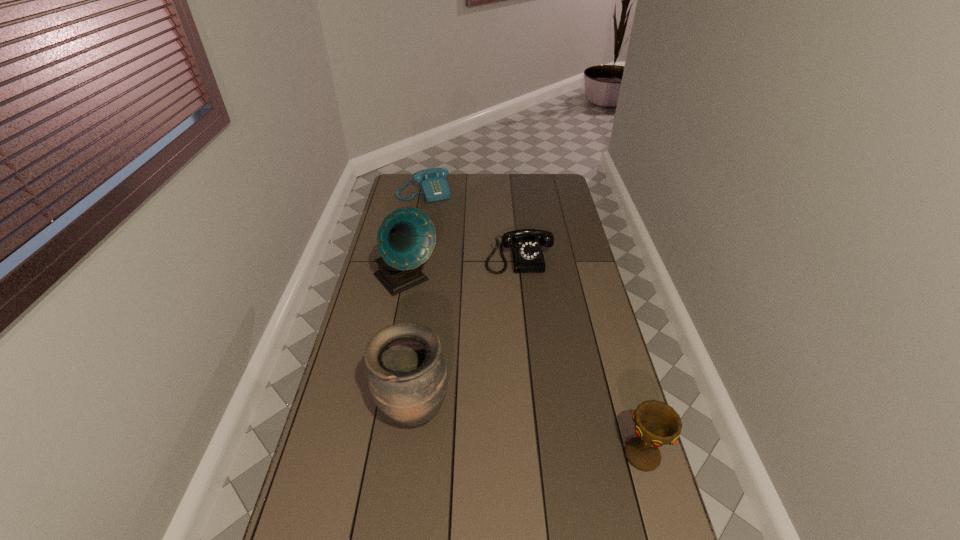
Identify the location of urn present at the left edge. This screenshot has width=960, height=540. (407, 375).

At what (x,y) coordinates should I click in order to perform the action: click on telephone that is at the left edge. Please return your answer as a coordinate pair (x, y). The height and width of the screenshot is (540, 960). Looking at the image, I should click on (432, 182).

I want to click on phonograph_record present at the left edge, so click(x=406, y=238).

What are the coordinates of `chalice located at the right edge` in the screenshot? It's located at click(656, 423).

At what (x,y) coordinates should I click in order to perform the action: click on telephone situated at the right edge. Please return your answer as a coordinate pair (x, y). Looking at the image, I should click on (525, 245).

Locate an element on the screen. The width and height of the screenshot is (960, 540). object at the far left corner is located at coordinates (432, 182).

What are the coordinates of `vacant region at the far edge of the desktop` in the screenshot? It's located at (476, 195).

Locate an element on the screen. Image resolution: width=960 pixels, height=540 pixels. free space at the left edge of the desktop is located at coordinates [x=391, y=318].

Locate an element on the screen. The image size is (960, 540). vacant space at the right edge of the desktop is located at coordinates (575, 283).

The image size is (960, 540). In order to click on free space between the third shortest object and the urn in this screenshot , I will do `click(529, 434)`.